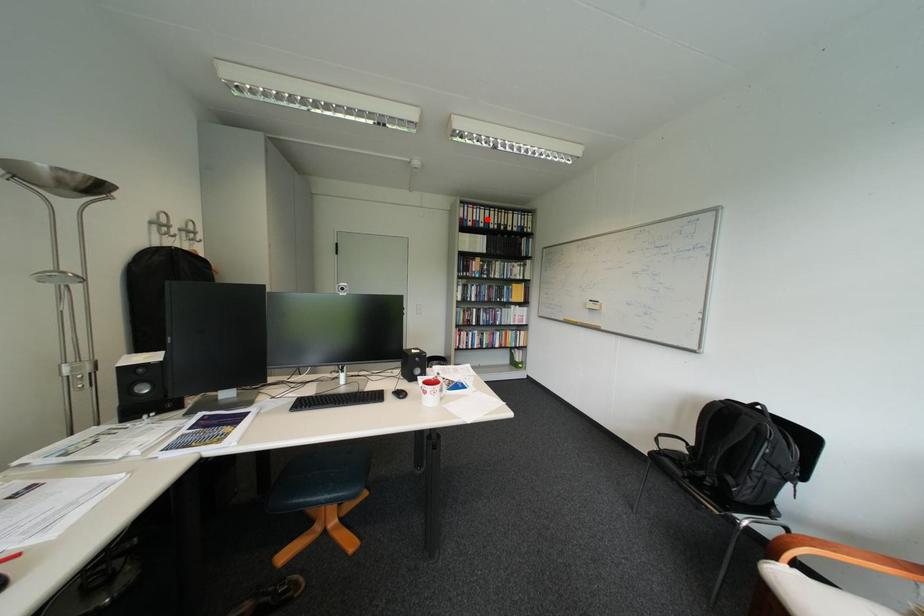
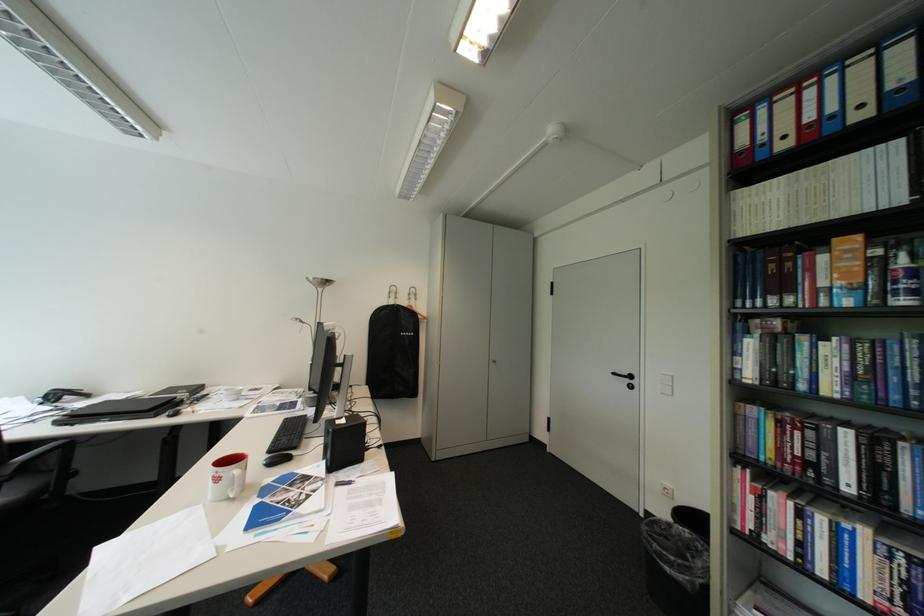
Question: A red point is marked in image1. In image2, is the corresponding 3D point closer to the camera or farther? Reply with the corresponding letter.

Choices:
 (A) The corresponding 3D point is closer.
 (B) The corresponding 3D point is farther.

Answer: (B)